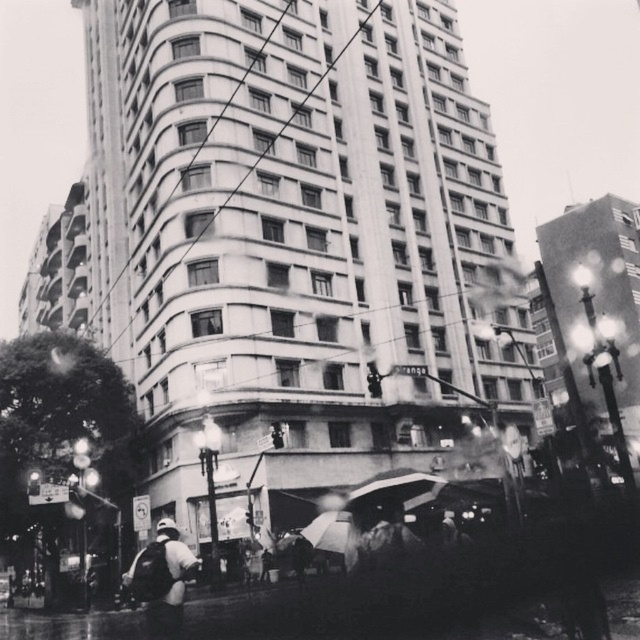
You are a delivery drone operator who needs to deliver a package to the transparent plastic umbrella at center. Your drone can carry a maximum weight of 20 kilograms. The white fabric backpack at lower left weighs 18 kilograms. Can your drone safely pick up the backpack and deliver it to the umbrella?

The distance between the white fabric backpack at lower left and the transparent plastic umbrella at center is 14.44 meters. Since the backpack weighs 18 kilograms, which is under the drone operator maximum weight capacity of 20 kilograms, the drone can safely pick up the backpack and deliver it to the umbrella.

You are a photographer trying to capture the reflection of the building in the wet street. You notice the white fabric backpack at lower left and the transparent plastic umbrella at center. Which object is closer to the left side of the image?

The white fabric backpack at lower left is to the left of the transparent plastic umbrella at center, so it is closer to the left side of the image.

In the urban scene, there is a white fabric backpack at lower left and a black matte umbrella at center. From the perspective of someone standing on the street, which object is positioned more to the left?

The white fabric backpack at lower left is positioned more to the left than the black matte umbrella at center.